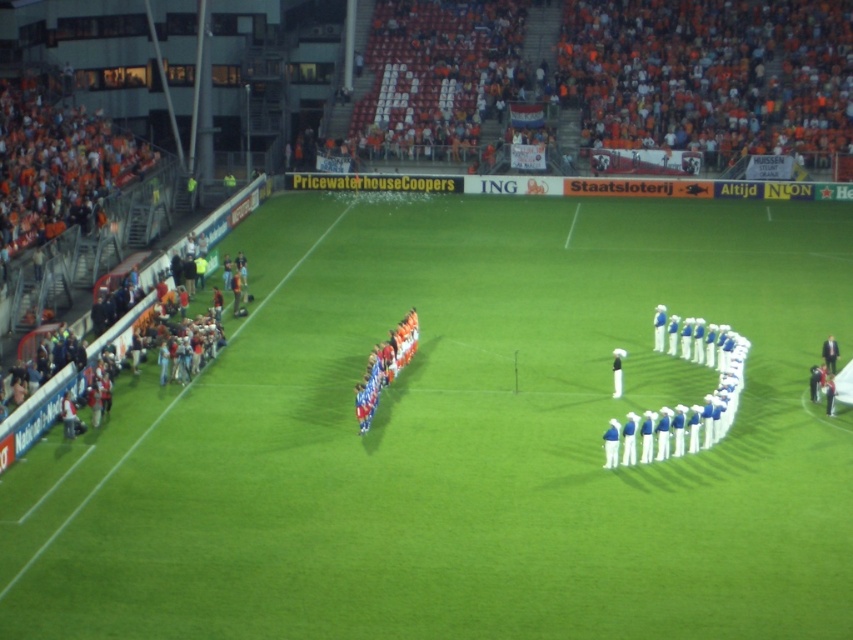
You are a photographer at the soccer stadium. You want to take a photo that includes both the blue uniformed people at center and the white fabric person at center. Which one will appear taller in the photo?

The white fabric person at center will appear taller in the photo because the blue uniformed people at center is not as tall as white fabric person at center.

You are a photographer trying to capture a photo of the green grass football field at center and the white cotton uniform at center from above. Which object will appear larger in your photo?

The green grass football field at center will appear larger in the photo because it is taller than the white cotton uniform at center.